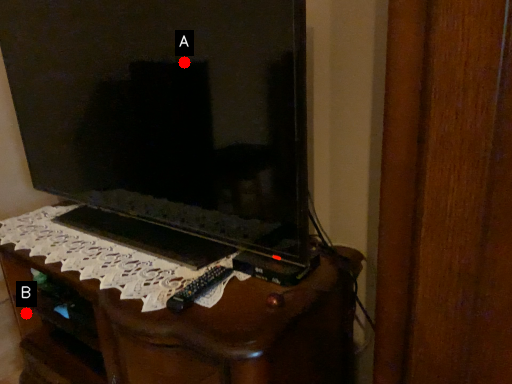
Question: Two points are circled on the image, labeled by A and B beside each circle. Which of the following is the farthest from the observer?

Choices:
 (A) A is further
 (B) B is further

Answer: (B)